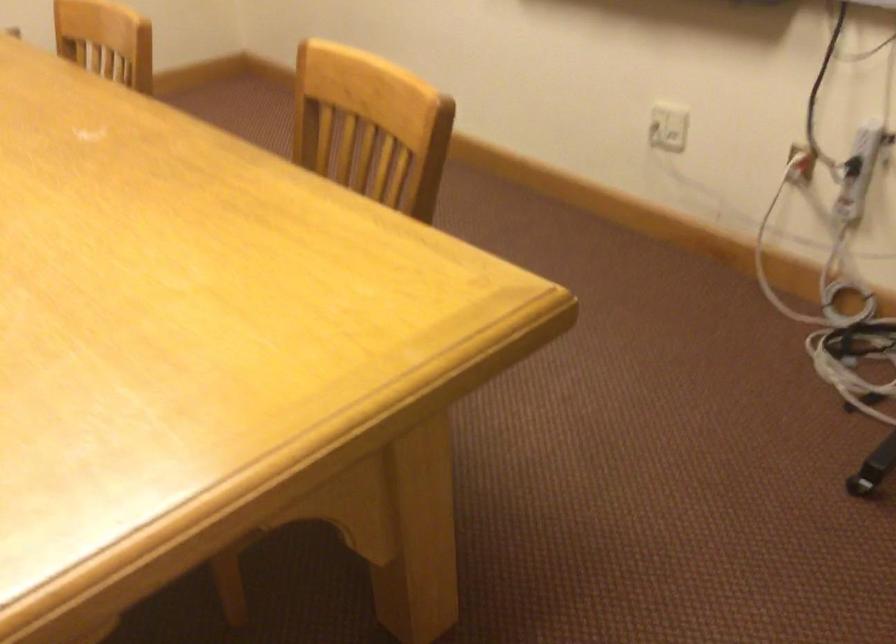
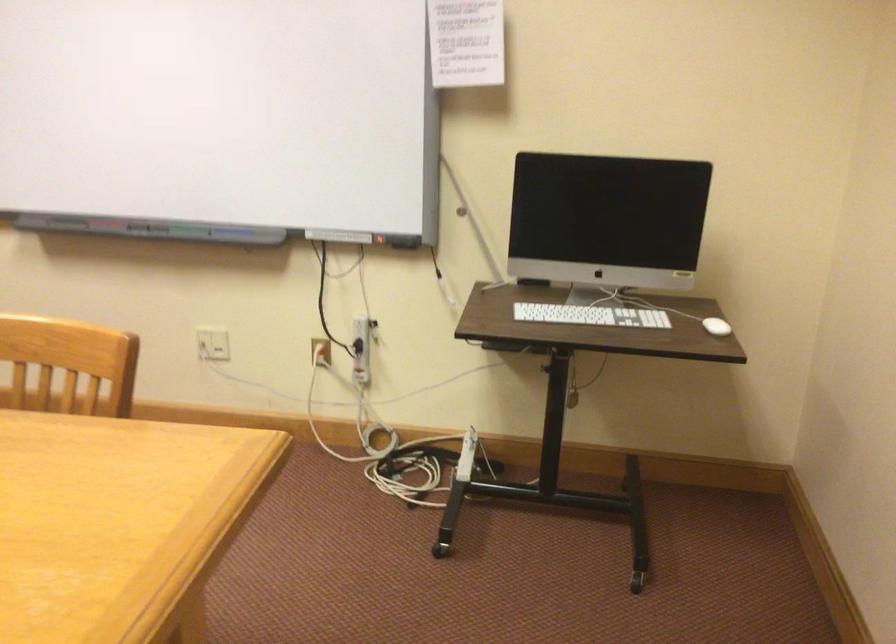
Where in the second image is the point corresponding to the point at 807,167 from the first image?

(321, 351)